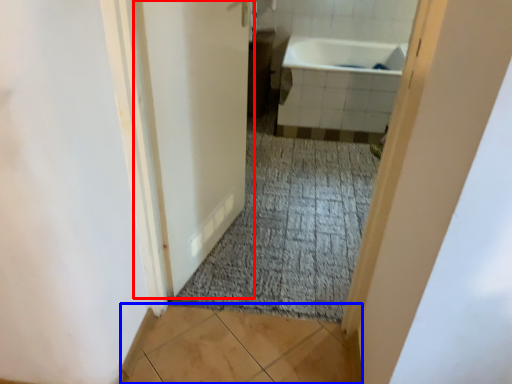
Question: Which point is further to the camera, door (highlighted by a red box) or tile (highlighted by a blue box)?

Choices:
 (A) door
 (B) tile

Answer: (B)